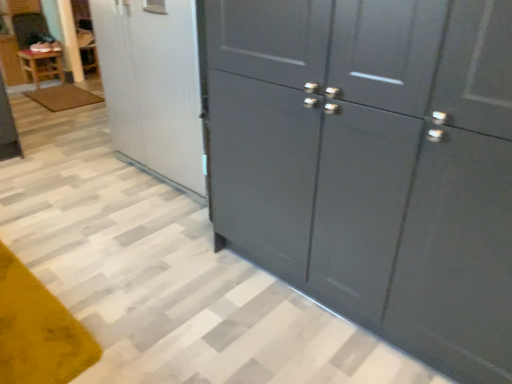
Where is `free space above wooden table at left (from a real-world perspective)`? free space above wooden table at left (from a real-world perspective) is located at coordinates (41, 49).